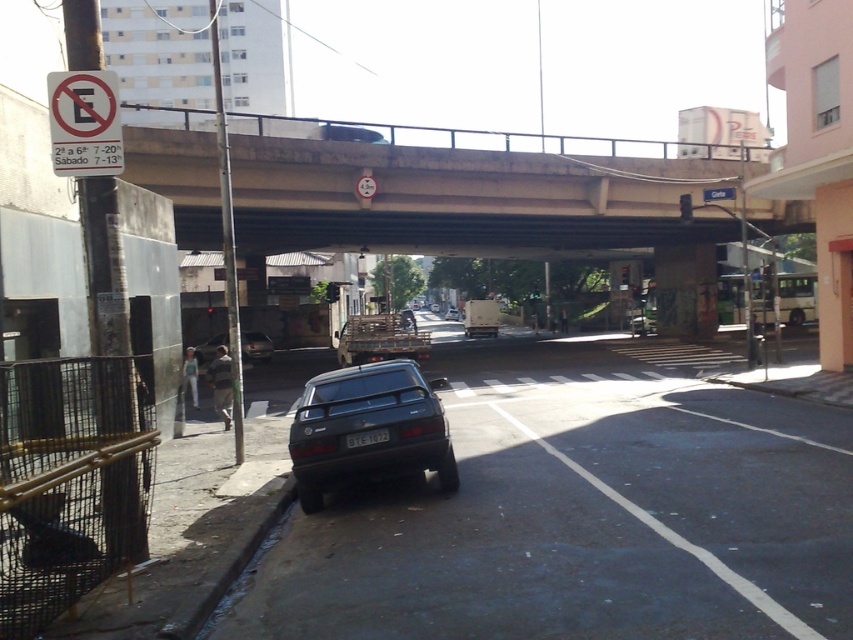
Question: Which object is the closest to the shiny black sedan at center?

Choices:
 (A) black plastic license plate at center
 (B) concrete bridge at center
 (C) white plastic sign at upper left

Answer: (B)

Question: Which object appears closest to the camera in this image?

Choices:
 (A) matte black car at center
 (B) glossy black car at center

Answer: (B)

Question: Is concrete bridge at center below green plastic traffic sign at center?

Choices:
 (A) yes
 (B) no

Answer: (B)

Question: Can you confirm if black plastic license plate at center is positioned above shiny black sedan at center?

Choices:
 (A) yes
 (B) no

Answer: (B)

Question: Does white plastic sign at upper left come in front of green plastic traffic sign at center?

Choices:
 (A) yes
 (B) no

Answer: (A)

Question: Among these points, which one is farthest from the camera?

Choices:
 (A) (616, 164)
 (B) (109, 86)

Answer: (A)